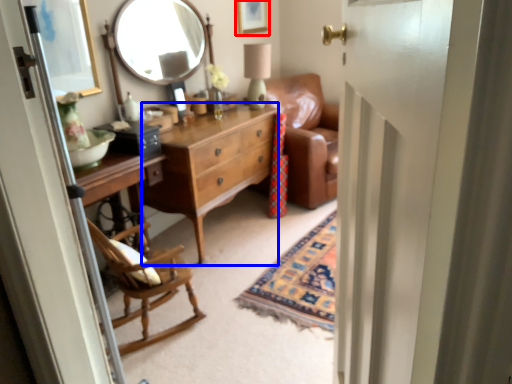
Question: Which object is closer to the camera taking this photo, picture frame (highlighted by a red box) or cabinetry (highlighted by a blue box)?

Choices:
 (A) picture frame
 (B) cabinetry

Answer: (B)